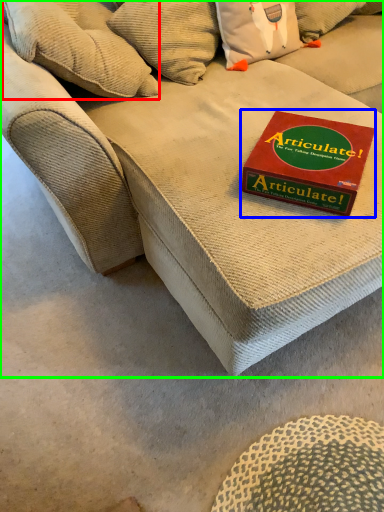
Question: Considering the real-world distances, which object is farthest from pillow (highlighted by a red box)? paperback book (highlighted by a blue box) or studio couch (highlighted by a green box)?

Choices:
 (A) paperback book
 (B) studio couch

Answer: (A)